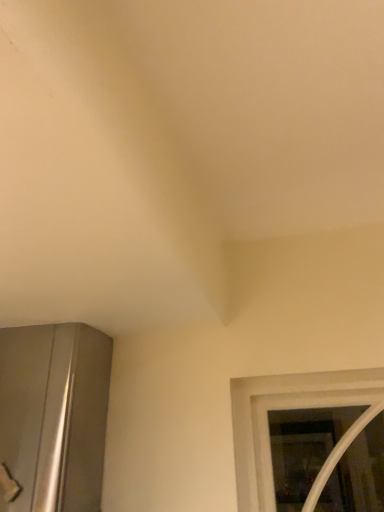
This screenshot has height=512, width=384. What do you see at coordinates (54, 415) in the screenshot? I see `silver metallic screen door at left` at bounding box center [54, 415].

You are a GUI agent. You are given a task and a screenshot of the screen. Output one action in this format:
    pyautogui.click(x=<x>, y=<y>)
    Task: Click on the silver metallic screen door at left
    The width and height of the screenshot is (384, 512).
    Given the screenshot: What is the action you would take?
    pyautogui.click(x=54, y=415)

The height and width of the screenshot is (512, 384). Identify the location of silver metallic screen door at left. (54, 415).